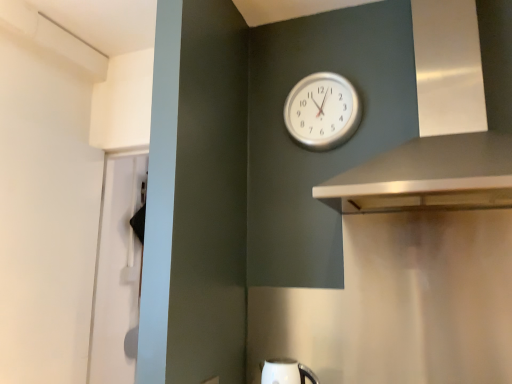
At what (x,y) coordinates should I click in order to perform the action: click on silver metallic vent at upper right. Please return your answer as a coordinate pair (x, y). The width and height of the screenshot is (512, 384). Looking at the image, I should click on (446, 147).

What do you see at coordinates (446, 147) in the screenshot?
I see `silver metallic vent at upper right` at bounding box center [446, 147].

Describe the element at coordinates (286, 372) in the screenshot. The height and width of the screenshot is (384, 512). I see `white glossy kettle at lower center` at that location.

The height and width of the screenshot is (384, 512). I want to click on white glossy kettle at lower center, so click(x=286, y=372).

What do you see at coordinates (322, 111) in the screenshot?
I see `silver metallic clock at upper center` at bounding box center [322, 111].

Locate an element on the screen. The image size is (512, 384). silver metallic vent at upper right is located at coordinates (446, 147).

Considering the sizes of objects silver metallic clock at upper center and white glossy kettle at lower center in the image provided, who is bigger, silver metallic clock at upper center or white glossy kettle at lower center?

silver metallic clock at upper center.

From the image's perspective, is silver metallic clock at upper center under white glossy kettle at lower center?

No, from the image's perspective, silver metallic clock at upper center is not below white glossy kettle at lower center.

Consider the image. Considering the relative sizes of silver metallic clock at upper center and white glossy kettle at lower center in the image provided, is silver metallic clock at upper center thinner than white glossy kettle at lower center?

Yes.

From the image's perspective, would you say silver metallic vent at upper right is shown under white glossy kettle at lower center?

No, from the image's perspective, silver metallic vent at upper right is not beneath white glossy kettle at lower center.

From the picture: From a real-world perspective, between silver metallic vent at upper right and white glossy kettle at lower center, who is vertically higher?

A: silver metallic vent at upper right, from a real-world perspective.

Considering the relative sizes of silver metallic vent at upper right and white glossy kettle at lower center in the image provided, is silver metallic vent at upper right bigger than white glossy kettle at lower center?

Correct, silver metallic vent at upper right is larger in size than white glossy kettle at lower center.

From the picture: Does silver metallic vent at upper right lie behind white glossy kettle at lower center?

No, it is in front of white glossy kettle at lower center.

Considering the sizes of white glossy kettle at lower center and silver metallic clock at upper center in the image, is white glossy kettle at lower center bigger or smaller than silver metallic clock at upper center?

Clearly, white glossy kettle at lower center is smaller in size than silver metallic clock at upper center.

Would you say white glossy kettle at lower center is inside or outside silver metallic clock at upper center?

white glossy kettle at lower center lies outside silver metallic clock at upper center.

Is white glossy kettle at lower center behind silver metallic clock at upper center?

No, the depth of white glossy kettle at lower center is less than that of silver metallic clock at upper center.

From the image's perspective, which one is positioned higher, white glossy kettle at lower center or silver metallic clock at upper center?

silver metallic clock at upper center appears higher in the image.

From a real-world perspective, is silver metallic clock at upper center on top of silver metallic vent at upper right?

Yes, from a real-world perspective, silver metallic clock at upper center is on top of silver metallic vent at upper right.

In terms of height, does silver metallic clock at upper center look taller or shorter compared to silver metallic vent at upper right?

Considering their sizes, silver metallic clock at upper center has less height than silver metallic vent at upper right.

Which object is further away from the camera taking this photo, silver metallic clock at upper center or silver metallic vent at upper right?

silver metallic clock at upper center is further away from the camera.

Based on the photo, is silver metallic clock at upper center outside of silver metallic vent at upper right?

Absolutely, silver metallic clock at upper center is external to silver metallic vent at upper right.

Would you say white glossy kettle at lower center is to the left or to the right of silver metallic vent at upper right in the picture?

Clearly, white glossy kettle at lower center is on the left of silver metallic vent at upper right in the image.

Locate an element on the screen. Image resolution: width=512 pixels, height=384 pixels. vent located on the right of white glossy kettle at lower center is located at coordinates (446, 147).

In the scene shown: Considering the relative sizes of white glossy kettle at lower center and silver metallic vent at upper right in the image provided, is white glossy kettle at lower center wider than silver metallic vent at upper right?

Incorrect, the width of white glossy kettle at lower center does not surpass that of silver metallic vent at upper right.

Measure the distance between white glossy kettle at lower center and silver metallic vent at upper right.

38.38 inches.

From the picture: Considering the positions of objects silver metallic vent at upper right and silver metallic clock at upper center in the image provided, who is more to the right, silver metallic vent at upper right or silver metallic clock at upper center?

silver metallic vent at upper right.

Can you confirm if silver metallic vent at upper right is wider than silver metallic clock at upper center?

Yes.

Is silver metallic vent at upper right not near silver metallic clock at upper center?

No, there isn't a large distance between silver metallic vent at upper right and silver metallic clock at upper center.

In order to click on sink to the left of silver metallic clock at upper center in this screenshot , I will do `click(286, 372)`.

The image size is (512, 384). In the image, there is a silver metallic vent at upper right. What are the coordinates of `sink below it (from the image's perspective)` in the screenshot? It's located at (286, 372).

Considering their positions, is silver metallic vent at upper right positioned closer to silver metallic clock at upper center than white glossy kettle at lower center?

silver metallic vent at upper right lies closer to silver metallic clock at upper center than the other object.

Looking at the image, which one is located closer to white glossy kettle at lower center, silver metallic vent at upper right or silver metallic clock at upper center?

silver metallic vent at upper right.

Estimate the real-world distances between objects in this image. Which object is closer to silver metallic vent at upper right, silver metallic clock at upper center or white glossy kettle at lower center?

Among the two, silver metallic clock at upper center is located nearer to silver metallic vent at upper right.

Based on their spatial positions, is white glossy kettle at lower center or silver metallic clock at upper center closer to silver metallic vent at upper right?

The object closer to silver metallic vent at upper right is silver metallic clock at upper center.

Estimate the real-world distances between objects in this image. Which object is closer to silver metallic clock at upper center, white glossy kettle at lower center or silver metallic vent at upper right?

silver metallic vent at upper right is closer to silver metallic clock at upper center.

From the image, which object appears to be nearer to white glossy kettle at lower center, silver metallic clock at upper center or silver metallic vent at upper right?

silver metallic vent at upper right is positioned closer to the anchor white glossy kettle at lower center.

Where is `wall clock between silver metallic vent at upper right and white glossy kettle at lower center vertically`? The height and width of the screenshot is (384, 512). wall clock between silver metallic vent at upper right and white glossy kettle at lower center vertically is located at coordinates (322, 111).